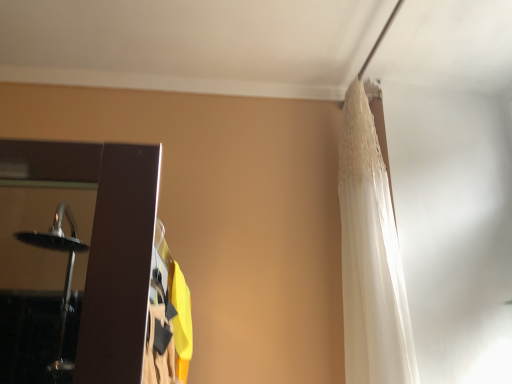
Question: From the image's perspective, is white lace curtain at upper right, which is the first curtain from left to right, above or below white lace curtain at upper right, the 1th curtain from the right?

Choices:
 (A) above
 (B) below

Answer: (B)

Question: In terms of width, does white lace curtain at upper right, which is the 2th curtain in right-to-left order, look wider or thinner when compared to white lace curtain at upper right, the second curtain positioned from the left?

Choices:
 (A) wide
 (B) thin

Answer: (A)

Question: Considering the positions of point (186, 339) and point (364, 301), is point (186, 339) closer or farther from the camera than point (364, 301)?

Choices:
 (A) closer
 (B) farther

Answer: (A)

Question: From the image's perspective, is white lace curtain at upper right, the 1th curtain from the right, positioned above or below white lace curtain at upper right, which is the 2th curtain in right-to-left order?

Choices:
 (A) above
 (B) below

Answer: (A)

Question: Relative to white lace curtain at upper right, which is the first curtain from left to right, is white lace curtain at upper right, the 1th curtain from the right, in front or behind?

Choices:
 (A) front
 (B) behind

Answer: (B)

Question: In terms of height, does white lace curtain at upper right, the 1th curtain from the right, look taller or shorter compared to white lace curtain at upper right, which is the 2th curtain in right-to-left order?

Choices:
 (A) short
 (B) tall

Answer: (B)

Question: From a real-world perspective, is white lace curtain at upper right, the second curtain positioned from the left, above or below white lace curtain at upper right, which is the first curtain from left to right?

Choices:
 (A) above
 (B) below

Answer: (A)